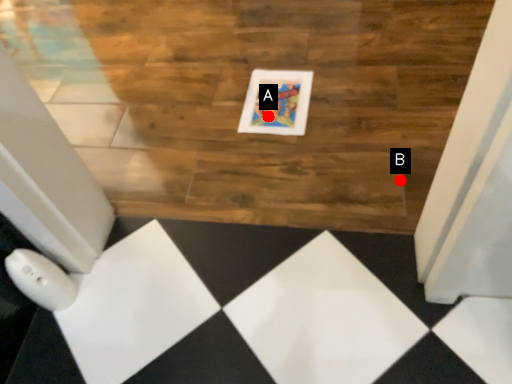
Question: Two points are circled on the image, labeled by A and B beside each circle. Which point is closer to the camera?

Choices:
 (A) A is closer
 (B) B is closer

Answer: (B)